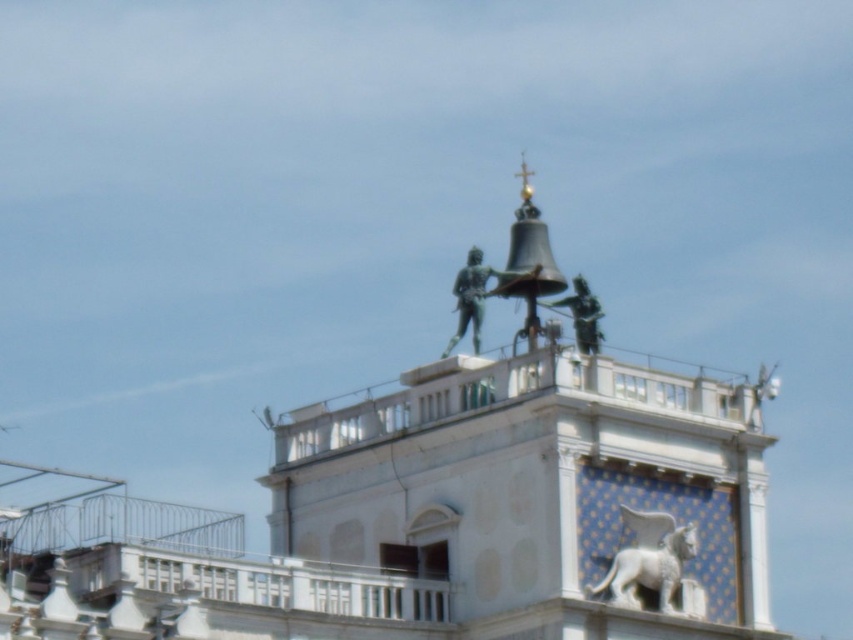
Is white marble lion at center thinner than green patina statue at center?

Correct, white marble lion at center's width is less than green patina statue at center's.

Is point (643, 554) behind point (503, 282)?

No, (643, 554) is in front of (503, 282).

Identify the location of white marble lion at center. (653, 564).

Which of these two, green patina statue at center or green patina statue at upper center, stands shorter?

green patina statue at upper center is shorter.

Is green patina statue at center to the left of green patina statue at upper center from the viewer's perspective?

Correct, you'll find green patina statue at center to the left of green patina statue at upper center.

The image size is (853, 640). What are the coordinates of `green patina statue at center` in the screenshot? It's located at (479, 294).

At what (x,y) coordinates should I click in order to perform the action: click on green patina statue at center. Please return your answer as a coordinate pair (x, y). Looking at the image, I should click on (479, 294).

Is bronze statue at center thinner than white marble lion at center?

Incorrect, bronze statue at center's width is not less than white marble lion at center's.

Does bronze statue at center appear on the right side of white marble lion at center?

No, bronze statue at center is not to the right of white marble lion at center.

Between point (531, 252) and point (602, 580), which one is positioned behind?

The point (531, 252) is more distant.

Identify the location of bronze statue at center. The image size is (853, 640). (541, 484).